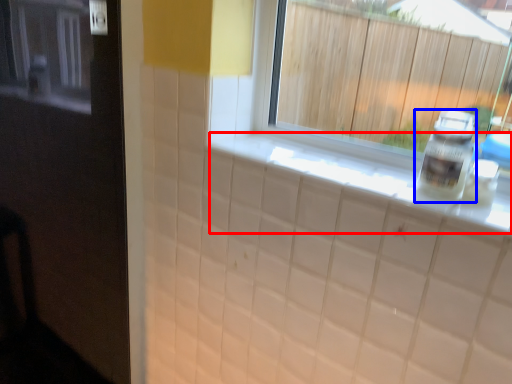
Question: Which of the following is the farthest to the observer, counter top (highlighted by a red box) or bottle (highlighted by a blue box)?

Choices:
 (A) counter top
 (B) bottle

Answer: (B)